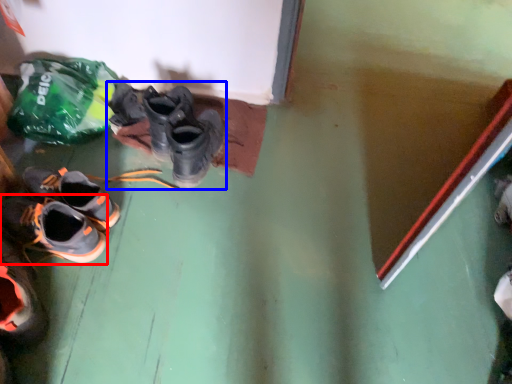
Question: Which point is further to the camera, shoe (highlighted by a red box) or footwear (highlighted by a blue box)?

Choices:
 (A) shoe
 (B) footwear

Answer: (B)